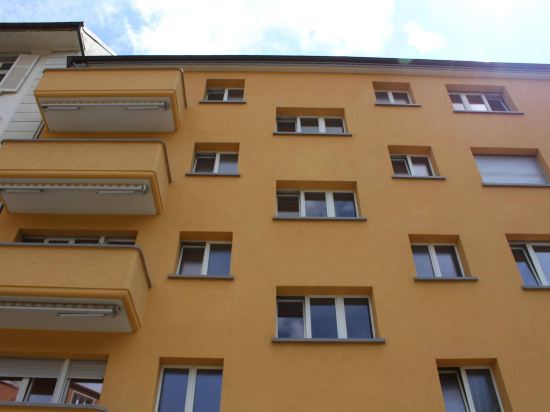
Where is `set of large windows top right`? set of large windows top right is located at coordinates (480, 101).